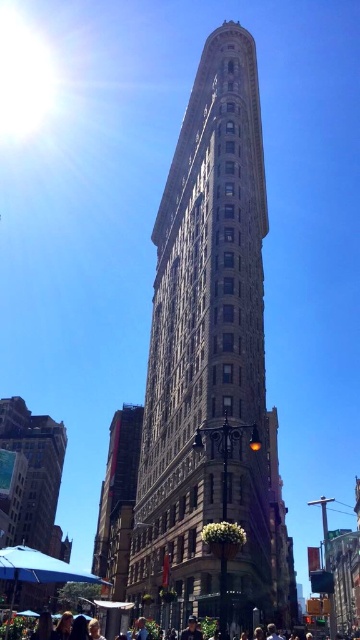
You are a photographer standing at the street level in front of the stone textured building at center. You want to take a photo of the matte black people at lower center without the building in the background. Is this possible given their positions?

The stone textured building at center is located above the matte black people at lower center, so if you position yourself directly in front of the matte black people at lower center and aim your camera downward, you can capture them without the building in the background.

You are standing on the sidewalk in front of the stone textured building at center. You want to walk towards the matte black people at lower center. Which direction should you go to reach them?

The stone textured building at center is further to the viewer than matte black people at lower center, so you should walk forward towards the matte black people at lower center who are closer to you.